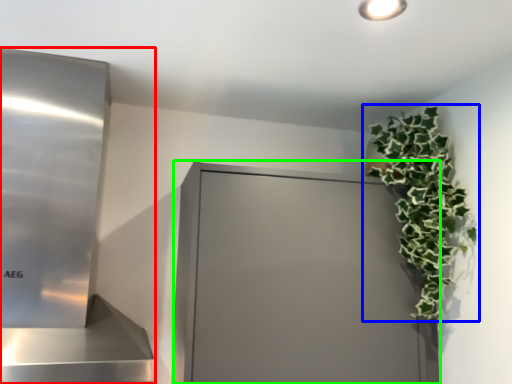
Question: Based on their relative distances, which object is farther from appliance (highlighted by a red box)? Choose from houseplant (highlighted by a blue box) and glass door (highlighted by a green box).

Choices:
 (A) houseplant
 (B) glass door

Answer: (A)